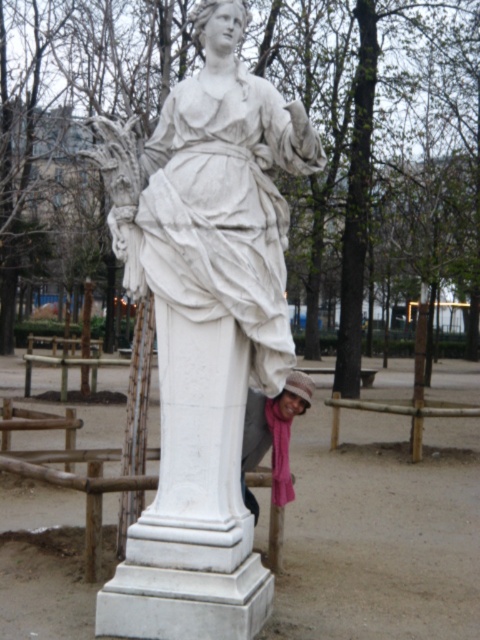
Who is higher up, white marble statue at center or pink fabric scarf at lower center?

white marble statue at center is above.

Identify the location of white marble statue at center. (204, 328).

Who is positioned more to the right, white marble pillar at center or pink fabric scarf at lower center?

From the viewer's perspective, pink fabric scarf at lower center appears more on the right side.

Which is more to the left, white marble pillar at center or pink fabric scarf at lower center?

white marble pillar at center

Locate an element on the screen. This screenshot has width=480, height=640. white marble pillar at center is located at coordinates (192, 500).

Does white marble statue at center lie behind white marble pillar at center?

No, white marble statue at center is in front of white marble pillar at center.

Who is positioned more to the right, white marble statue at center or white marble pillar at center?

white marble pillar at center

This screenshot has width=480, height=640. Identify the location of white marble statue at center. (204, 328).

Find the location of a particular element. The width and height of the screenshot is (480, 640). white marble statue at center is located at coordinates (204, 328).